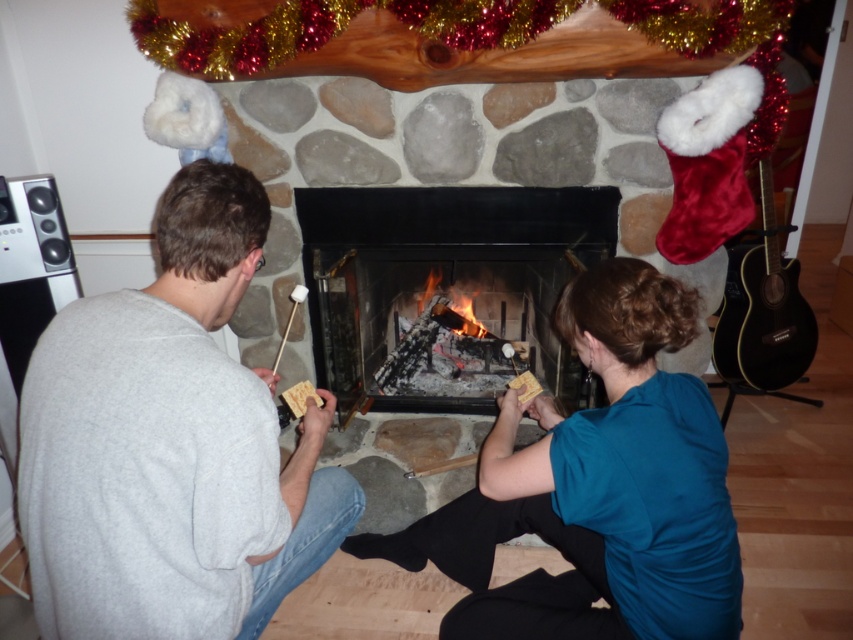
Can you confirm if teal fabric shirt at center is positioned above charcoal black wood at center?

No.

Between teal fabric shirt at center and charcoal black wood at center, which one is positioned lower?

Positioned lower is teal fabric shirt at center.

You are a GUI agent. You are given a task and a screenshot of the screen. Output one action in this format:
    pyautogui.click(x=<x>, y=<y>)
    Task: Click on the teal fabric shirt at center
    The width and height of the screenshot is (853, 640).
    Given the screenshot: What is the action you would take?
    pyautogui.click(x=596, y=488)

Is teal fabric shirt at center behind black stone fireplace at center?

That is False.

Image resolution: width=853 pixels, height=640 pixels. I want to click on teal fabric shirt at center, so click(596, 488).

Who is positioned more to the left, teal fabric shirt at center or black wood guitar at right?

From the viewer's perspective, teal fabric shirt at center appears more on the left side.

Does point (728, 506) come behind point (802, 326)?

That is False.

Locate an element on the screen. The height and width of the screenshot is (640, 853). teal fabric shirt at center is located at coordinates (596, 488).